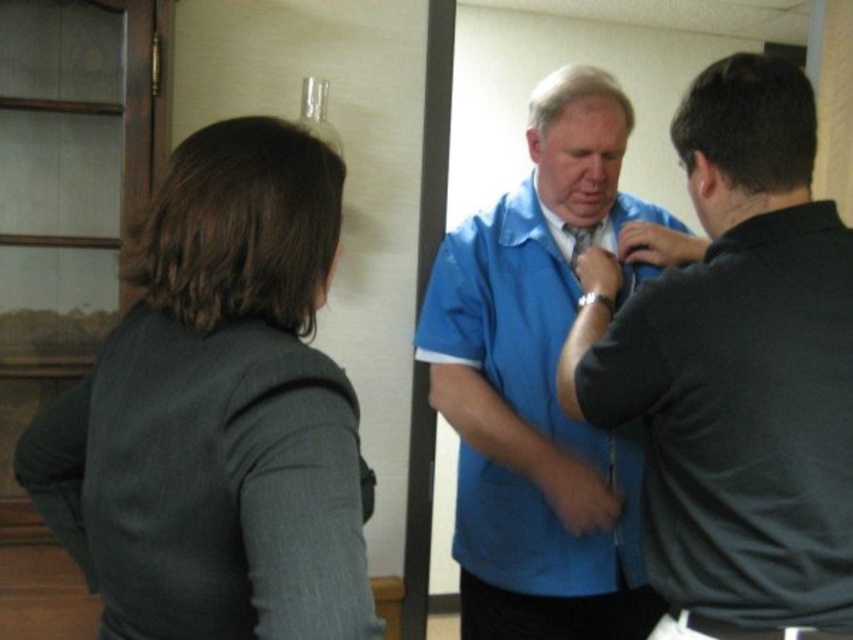
Based on the photo, does dark gray sweater at left have a lesser width compared to matte blue tie at center?

No.

Who is more forward, (308, 381) or (585, 244)?

Positioned in front is point (308, 381).

This screenshot has height=640, width=853. What are the coordinates of `dark gray sweater at left` in the screenshot? It's located at (218, 412).

Where is `matte blue shirt at center`? This screenshot has width=853, height=640. matte blue shirt at center is located at coordinates click(735, 372).

Is point (749, 148) in front of point (492, 637)?

Yes, point (749, 148) is in front of point (492, 637).

The width and height of the screenshot is (853, 640). Describe the element at coordinates (735, 372) in the screenshot. I see `matte blue shirt at center` at that location.

Locate an element on the screen. matte blue shirt at center is located at coordinates (735, 372).

Can you confirm if matte blue shirt at center is thinner than matte blue tie at center?

Incorrect, matte blue shirt at center's width is not less than matte blue tie at center's.

Can you confirm if matte blue shirt at center is positioned to the right of matte blue tie at center?

Indeed, matte blue shirt at center is positioned on the right side of matte blue tie at center.

Which is in front, point (819, 298) or point (595, 236)?

Positioned in front is point (819, 298).

The height and width of the screenshot is (640, 853). In order to click on matte blue shirt at center in this screenshot , I will do `click(735, 372)`.